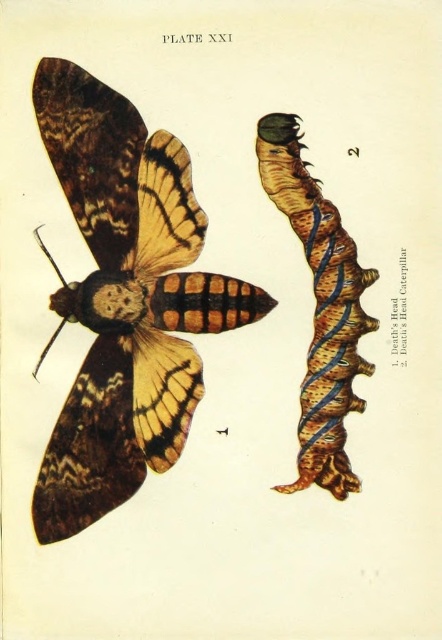
You are an entomologist examining the illustration of the brown textured moth at left. If the actual moth is 1.28 meters away from the camera, how does this distance compare to the typical flight range of the Death Head Hawkmoth?

The brown textured moth at left is depicted as 1.28 meters from the camera. The typical flight range of the Death Head Hawkmoth is much larger, so this distance is within its flight capability.

Based on the illustration labeled as PLATE XXI from a scientific publication, where is the brown textured moth at left positioned in terms of its 2D coordinates?

The brown textured moth at left is positioned at the 2D coordinates of point [125,300].